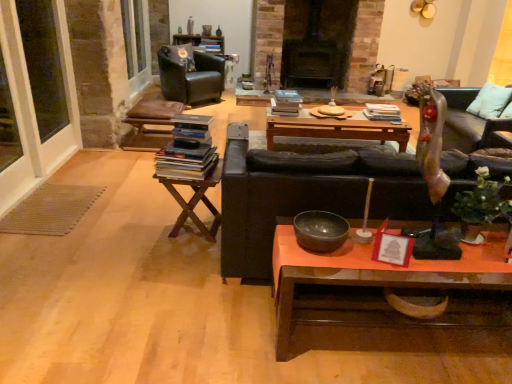
Identify the location of free spot below wooden polished coffee table at lower center, the 1th coffee table ordered from the bottom (from a real-world perspective). (405, 332).